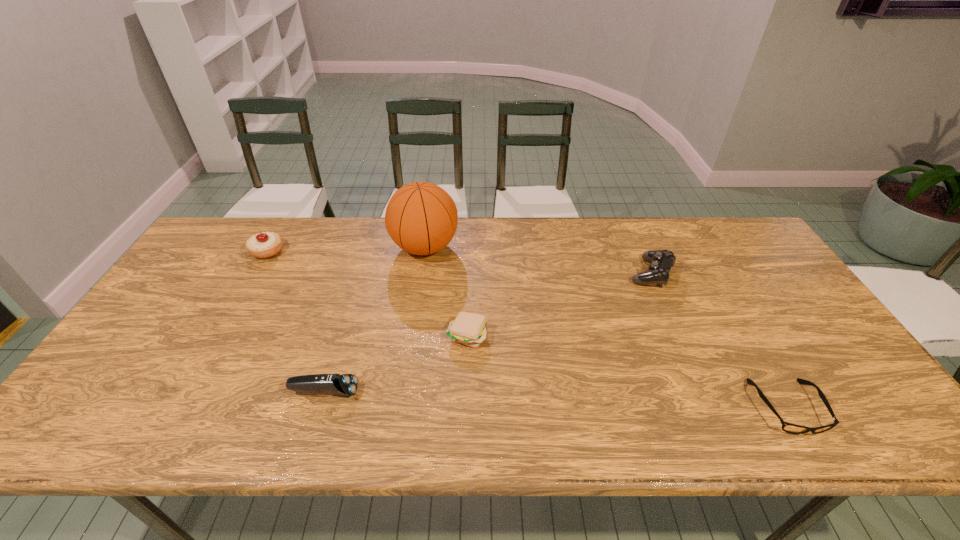
I want to click on vacant region located 0.070m on the back of the control, so 638,244.

You are a GUI agent. You are given a task and a screenshot of the screen. Output one action in this format:
    pyautogui.click(x=<x>, y=<y>)
    Task: Click on the vacant space located 0.210m on the head of the electric shaver
    Image resolution: width=960 pixels, height=540 pixels.
    Given the screenshot: What is the action you would take?
    pyautogui.click(x=448, y=392)

This screenshot has width=960, height=540. Identify the location of free spot located on the left of the fourth farthest object. (420, 335).

Where is `basketball situated at the far edge`? Image resolution: width=960 pixels, height=540 pixels. basketball situated at the far edge is located at coordinates (421, 218).

The image size is (960, 540). I want to click on pastry that is positioned at the far edge, so click(x=263, y=245).

Find the location of a particular element. control that is at the far edge is located at coordinates (661, 261).

What are the coordinates of `object located at the near edge` in the screenshot? It's located at (787, 427).

Image resolution: width=960 pixels, height=540 pixels. I want to click on object at the right edge, so click(787, 427).

The width and height of the screenshot is (960, 540). Identify the location of object present at the near right corner. (787, 427).

In order to click on free space at the far edge of the desktop in this screenshot , I will do `click(531, 219)`.